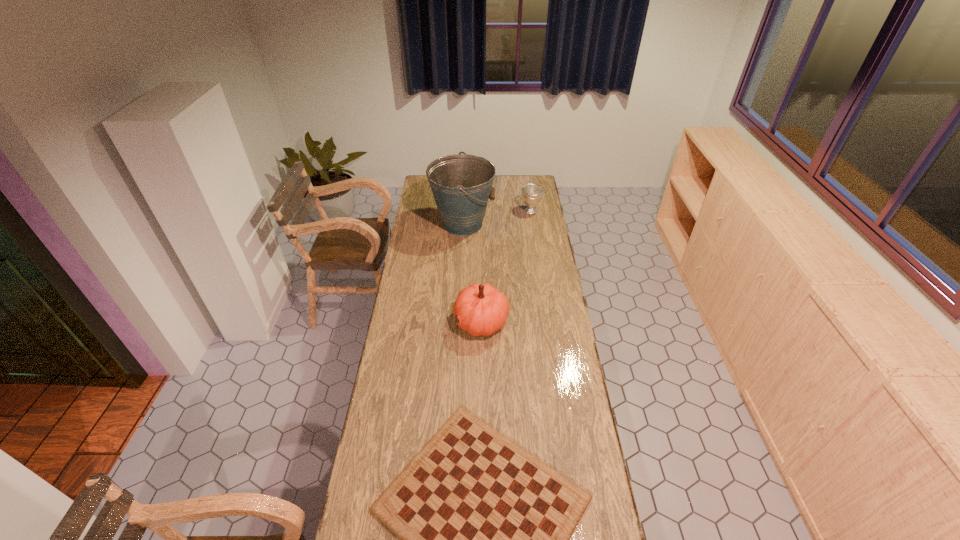
This screenshot has width=960, height=540. I want to click on object located at the right edge, so click(531, 193).

In the image, there is a desktop. At what (x,y) coordinates should I click in order to perform the action: click on free region at the far edge. Please return your answer as a coordinate pair (x, y). Looking at the image, I should click on (514, 178).

At what (x,y) coordinates should I click in order to perform the action: click on free space at the left edge. Please return your answer as a coordinate pair (x, y). Looking at the image, I should click on (415, 315).

The image size is (960, 540). I want to click on free region at the right edge of the desktop, so click(x=533, y=280).

I want to click on free region at the far left corner, so click(420, 186).

The height and width of the screenshot is (540, 960). Identify the location of free space between the bucket and the third tallest object. (496, 218).

This screenshot has width=960, height=540. In order to click on free space between the bucket and the second shortest object in this screenshot , I will do `click(496, 218)`.

Find the location of a particular element. This screenshot has width=960, height=540. free space between the chalice and the second nearest object is located at coordinates (506, 266).

Image resolution: width=960 pixels, height=540 pixels. I want to click on free area in between the third farthest object and the bucket, so click(471, 273).

Locate an element on the screen. free space between the third tallest object and the second nearest object is located at coordinates (506, 266).